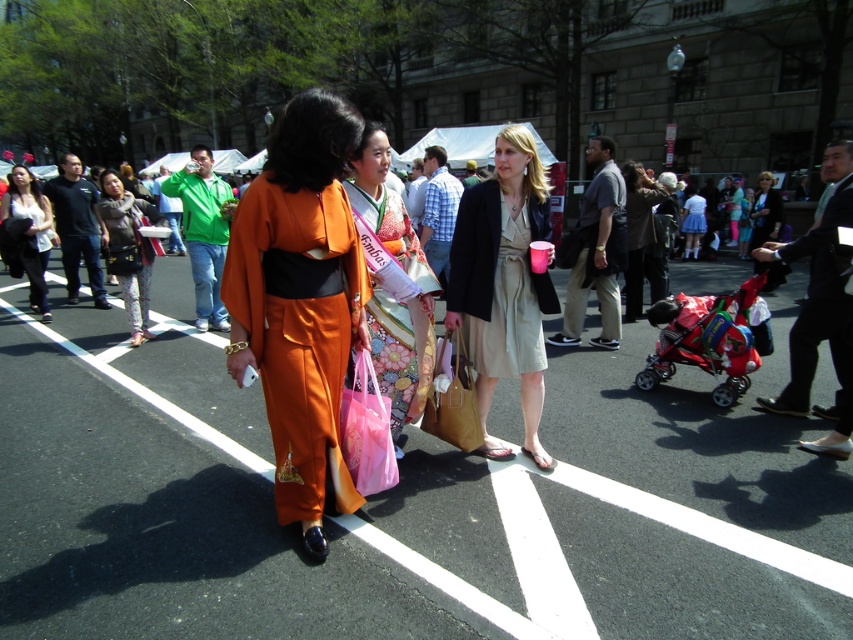
Can you confirm if orange silk kimono at center is positioned to the left of brown leather jacket at center?

Indeed, orange silk kimono at center is positioned on the left side of brown leather jacket at center.

Does point (323, 410) come behind point (653, 182)?

That is False.

Is point (274, 378) positioned behind point (651, 296)?

That is False.

This screenshot has height=640, width=853. Find the location of `orange silk kimono at center`. orange silk kimono at center is located at coordinates (300, 304).

Does matte black purse at center have a greater height compared to brown leather jacket at center?

No.

Is point (131, 220) behind point (659, 193)?

No, (131, 220) is closer to viewer.

At what (x,y) coordinates should I click in order to perform the action: click on matte black purse at center. Please return your answer as a coordinate pair (x, y). Image resolution: width=853 pixels, height=640 pixels. Looking at the image, I should click on (128, 250).

Which is below, silky orange kimono at center or matte black jacket at left?

silky orange kimono at center is lower down.

Who is positioned more to the right, silky orange kimono at center or matte black jacket at left?

silky orange kimono at center is more to the right.

Is point (364, 205) farther from camera compared to point (35, 289)?

No.

I want to click on silky orange kimono at center, so click(x=386, y=291).